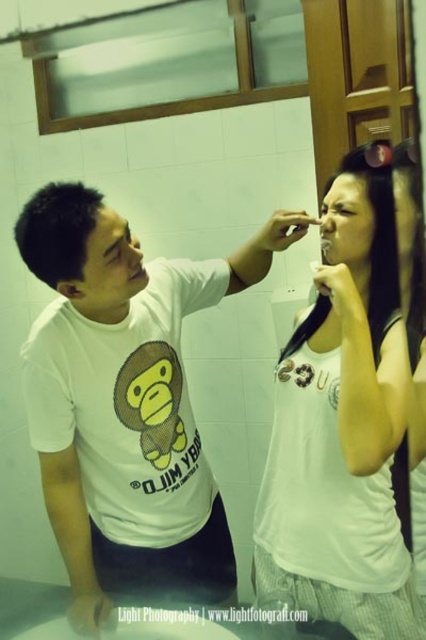
This screenshot has width=426, height=640. What are the coordinates of `white matte t-shirt at center` in the screenshot? It's located at point(126,401).

Which is behind, point (80, 321) or point (391, 216)?

Point (80, 321)

Does point (103, 340) come behind point (379, 269)?

That is True.

The width and height of the screenshot is (426, 640). In order to click on white matte t-shirt at center in this screenshot , I will do `click(126, 401)`.

Can you confirm if white cotton shirt at upper center is positioned to the left of yellow matte mouth at center?

No, white cotton shirt at upper center is not to the left of yellow matte mouth at center.

Which is in front, point (408, 365) or point (141, 275)?

Positioned in front is point (408, 365).

Image resolution: width=426 pixels, height=640 pixels. In order to click on white cotton shirt at upper center in this screenshot , I will do `click(344, 426)`.

At what (x,y) coordinates should I click in order to perform the action: click on white matte t-shirt at center. Please return your answer as a coordinate pair (x, y). Image resolution: width=426 pixels, height=640 pixels. Looking at the image, I should click on (126, 401).

Looking at this image, does white matte t-shirt at center appear on the left side of yellow matte mouth at center?

In fact, white matte t-shirt at center is to the right of yellow matte mouth at center.

What do you see at coordinates (126, 401) in the screenshot? The image size is (426, 640). I see `white matte t-shirt at center` at bounding box center [126, 401].

You are a GUI agent. You are given a task and a screenshot of the screen. Output one action in this format:
    pyautogui.click(x=<x>, y=<y>)
    Task: Click on the white matte t-shirt at center
    Image resolution: width=426 pixels, height=640 pixels.
    Given the screenshot: What is the action you would take?
    pyautogui.click(x=126, y=401)